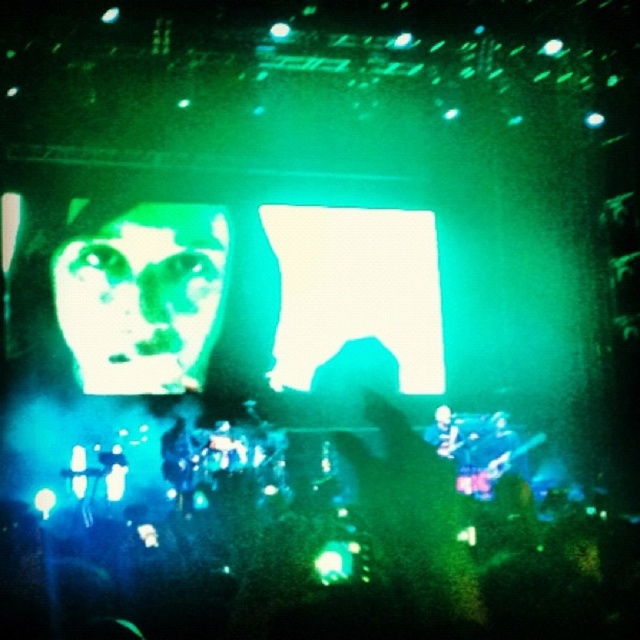
Does green matte face at center have a smaller size compared to white matte face at center?

No, green matte face at center is not smaller than white matte face at center.

Identify the location of green matte face at center. (144, 298).

Find the location of a particular element. green matte face at center is located at coordinates (144, 298).